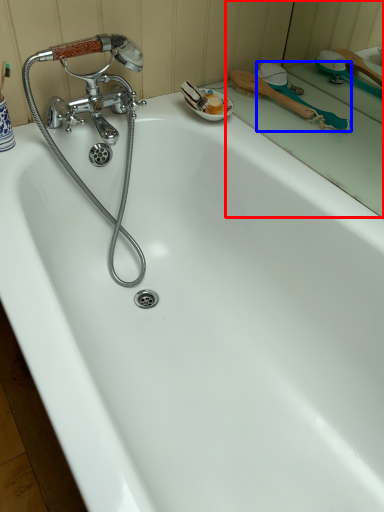
Question: Which object is further to the camera taking this photo, mirror (highlighted by a red box) or shower (highlighted by a blue box)?

Choices:
 (A) mirror
 (B) shower

Answer: (B)